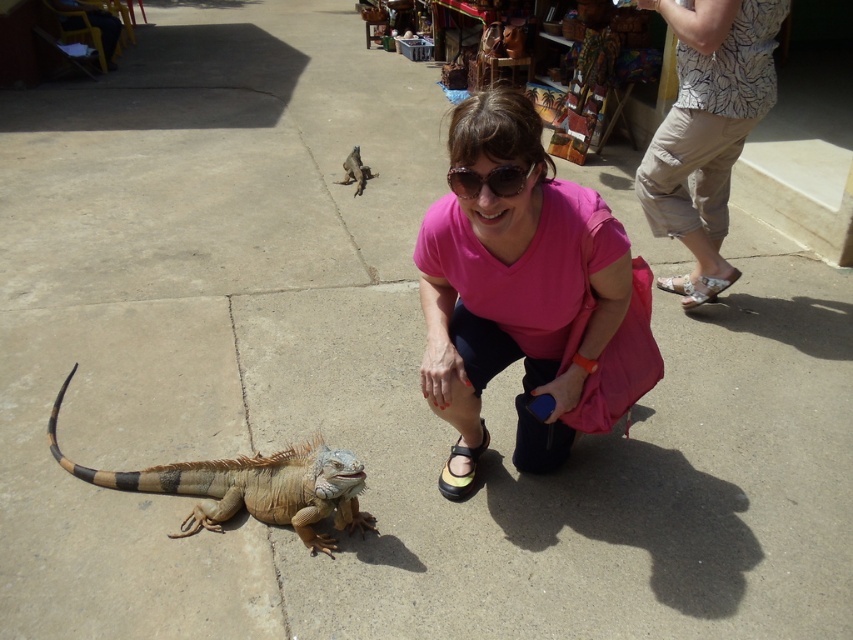
You are a photographer standing in the scene and want to take a picture of the brown scaly lizard at upper center without including the black synthetic sandal at lower center in the frame. Is this possible given their positions?

The black synthetic sandal at lower center is positioned under the brown scaly lizard at upper center, so if you position yourself to capture the lizard from above or adjust your angle to avoid the lower area where the sandal is located, it should be possible to exclude the sandal from the frame.

You are standing at the center of the image and want to find the printed cotton shirt at upper right. In which direction should you look?

The printed cotton shirt at upper right is located at point (706, 129), so you should look towards the upper right direction to find it.